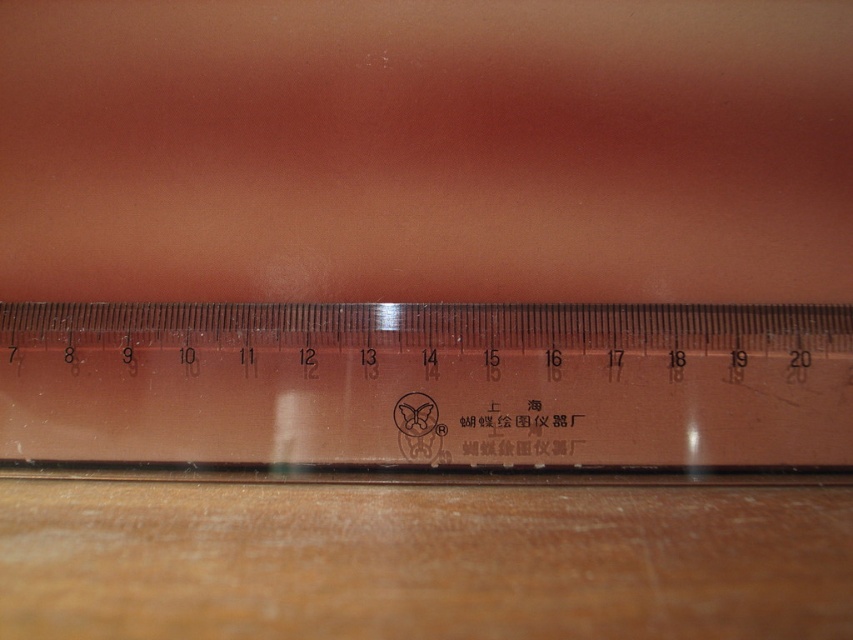
Between transparent plastic ruler at center and wooden table at lower center, which one is positioned lower?

wooden table at lower center

Does transparent plastic ruler at center have a lesser width compared to wooden table at lower center?

Incorrect, transparent plastic ruler at center's width is not less than wooden table at lower center's.

This screenshot has width=853, height=640. I want to click on transparent plastic ruler at center, so click(x=427, y=385).